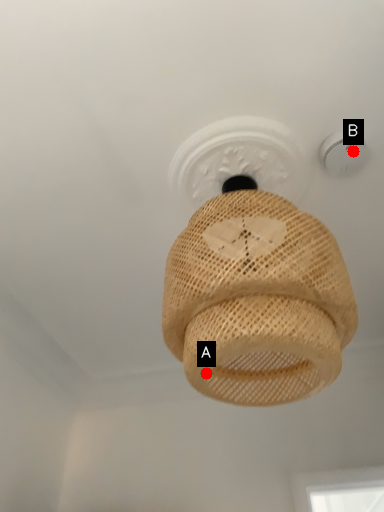
Question: Two points are circled on the image, labeled by A and B beside each circle. Which point is closer to the camera taking this photo?

Choices:
 (A) A is closer
 (B) B is closer

Answer: (A)